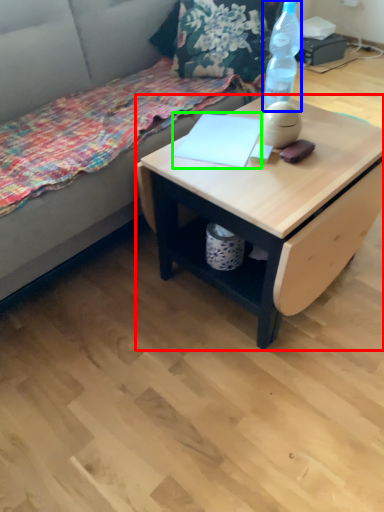
Question: Which object is the farthest from desk (highlighted by a red box)? Choose among these: bottle (highlighted by a blue box) or notepad (highlighted by a green box).

Choices:
 (A) bottle
 (B) notepad

Answer: (A)